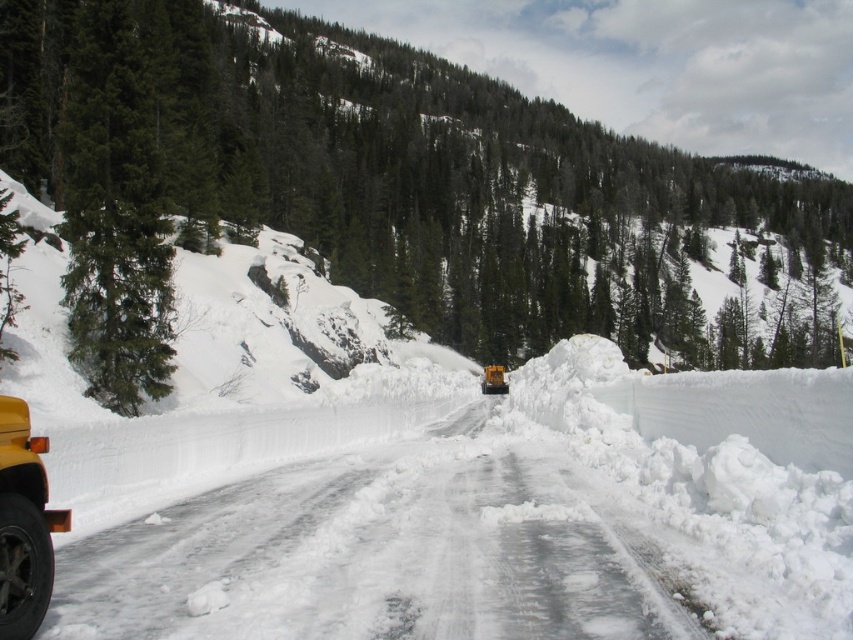
Question: Does green matte tree at left come behind yellow rubber plow at center?

Choices:
 (A) yes
 (B) no

Answer: (B)

Question: Does white snow-packed road at center appear under yellow rubber plow at left?

Choices:
 (A) yes
 (B) no

Answer: (A)

Question: Which object is farther from the camera taking this photo?

Choices:
 (A) green matte tree at left
 (B) white snow-packed road at center
 (C) yellow rubber plow at center
 (D) green textured tree at upper left

Answer: (C)

Question: Which point is closer to the camera taking this photo?

Choices:
 (A) (4, 420)
 (B) (460, 573)

Answer: (A)

Question: Can you confirm if white snow-packed road at center is positioned to the left of yellow rubber plow at center?

Choices:
 (A) yes
 (B) no

Answer: (A)

Question: Which of the following is the farthest from the observer?

Choices:
 (A) (495, 372)
 (B) (225, 620)
 (C) (512, 250)

Answer: (C)